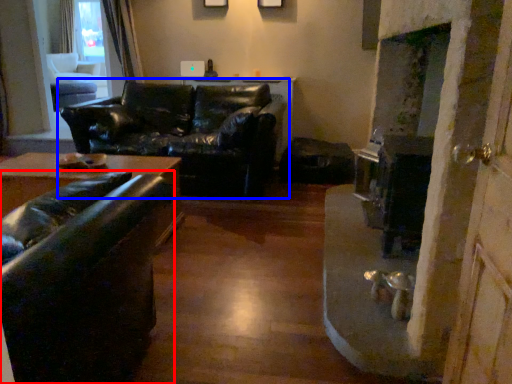
Question: Which of the following is the farthest to the observer, studio couch (highlighted by a red box) or studio couch (highlighted by a blue box)?

Choices:
 (A) studio couch
 (B) studio couch

Answer: (B)